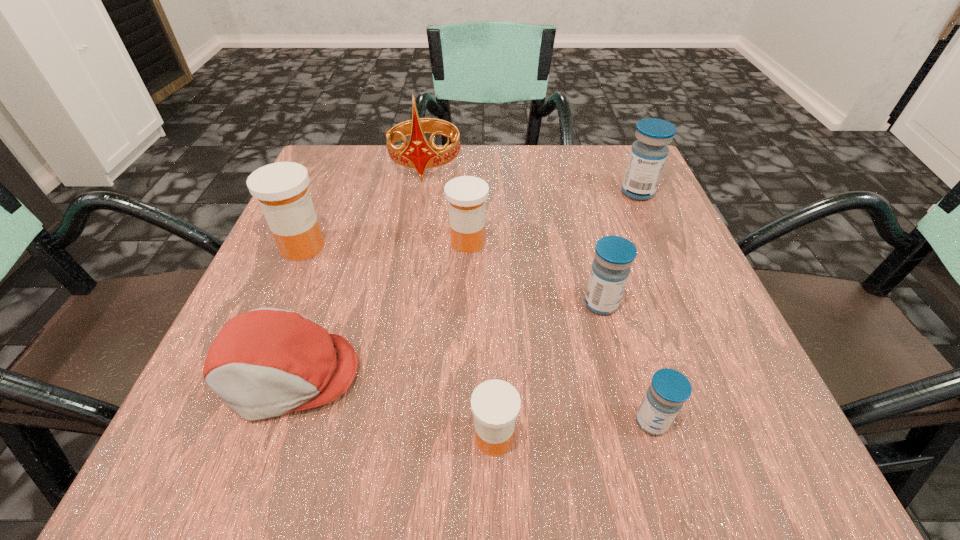
Find the location of a particular element. Image resolution: width=960 pixels, height=540 pixels. free space that satisfies the following two spatial constraints: 1. on the label of the biggest orange medicine; 2. on the back side of the nearest blue medicine is located at coordinates (227, 422).

What are the coordinates of `free space that satisfies the following two spatial constraints: 1. on the front-facing side of the tallest object; 2. on the right side of the smallest blue medicine` in the screenshot? It's located at (382, 422).

Find the location of a particular element. This screenshot has width=960, height=540. free location that satisfies the following two spatial constraints: 1. on the front-facing side of the tiara; 2. on the right side of the fourth nearest object is located at coordinates (402, 303).

At what (x,y) coordinates should I click in order to perform the action: click on vacant space that satisfies the following two spatial constraints: 1. on the front-facing side of the second smallest blue medicine; 2. on the right side of the tiara. Please return your answer as a coordinate pair (x, y). This screenshot has width=960, height=540. Looking at the image, I should click on (402, 303).

Where is `vacant area in the image that satisfies the following two spatial constraints: 1. on the front-facing side of the tallest object; 2. on the label of the biggest orange medicine`? This screenshot has width=960, height=540. vacant area in the image that satisfies the following two spatial constraints: 1. on the front-facing side of the tallest object; 2. on the label of the biggest orange medicine is located at coordinates (412, 246).